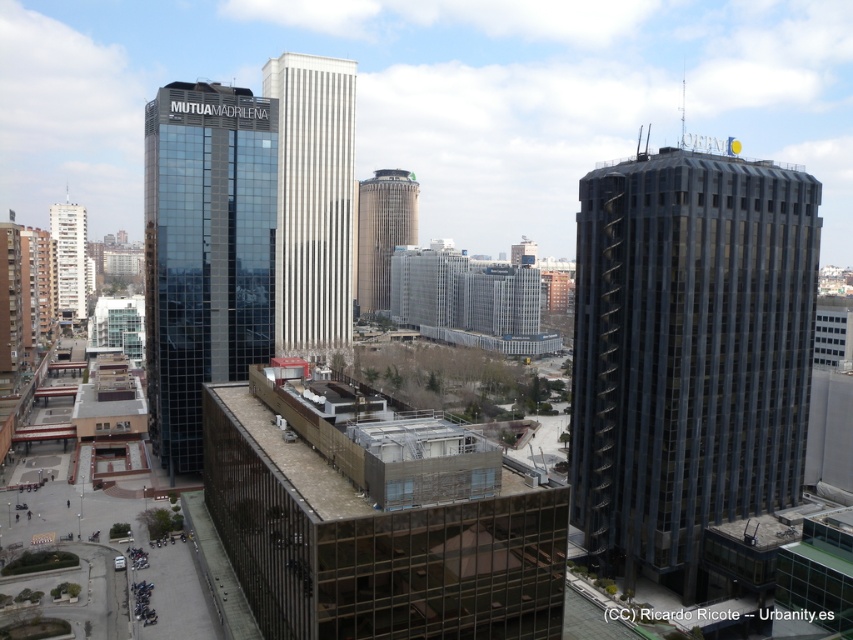
Does point (210, 317) lie in front of point (375, 200)?

Yes, point (210, 317) is closer to viewer.

Between matte glass building at center-left and smooth beige tower at center, which one appears on the left side from the viewer's perspective?

From the viewer's perspective, matte glass building at center-left appears more on the left side.

The width and height of the screenshot is (853, 640). Find the location of `matte glass building at center-left`. matte glass building at center-left is located at coordinates (206, 252).

Does matte glass building at center-left have a smaller size compared to white concrete building at left?

Indeed, matte glass building at center-left has a smaller size compared to white concrete building at left.

Can you confirm if matte glass building at center-left is wider than white concrete building at left?

No.

Is point (228, 346) positioned before point (59, 316)?

Yes, it is.

At what (x,y) coordinates should I click in order to perform the action: click on matte glass building at center-left. Please return your answer as a coordinate pair (x, y). Image resolution: width=853 pixels, height=640 pixels. Looking at the image, I should click on (206, 252).

Who is positioned more to the left, dark gray glass building at center or matte glass building at center-left?

matte glass building at center-left

Can you confirm if dark gray glass building at center is taller than matte glass building at center-left?

No, dark gray glass building at center is not taller than matte glass building at center-left.

Does point (801, 458) come in front of point (210, 376)?

Yes, it is in front of point (210, 376).

Find the location of a particular element. dark gray glass building at center is located at coordinates (688, 355).